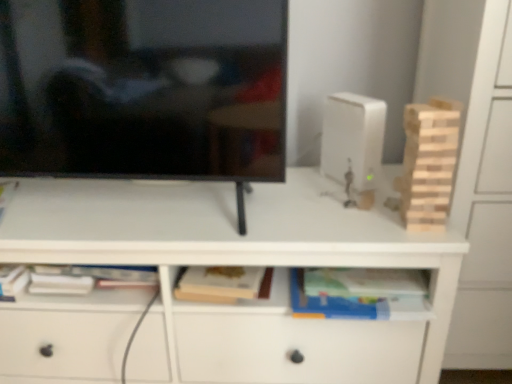
At what (x,y) coordinates should I click in order to perform the action: click on empty space that is ontop of white matte desk at center (from a real-world perspective). Please return your answer as a coordinate pair (x, y). Looking at the image, I should click on (203, 202).